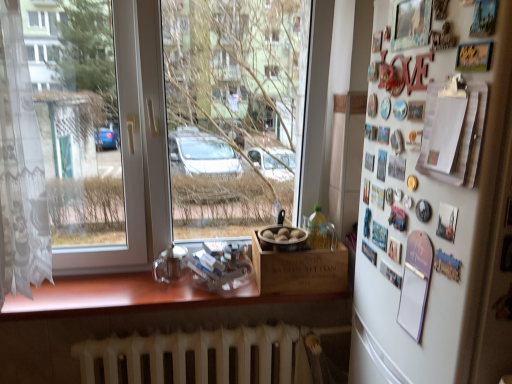
Question: Is white matte refrigerator at right bigger than wooden box at center?

Choices:
 (A) yes
 (B) no

Answer: (A)

Question: Is white matte refrigerator at right at the right side of wooden box at center?

Choices:
 (A) no
 (B) yes

Answer: (B)

Question: Is white matte refrigerator at right smaller than wooden box at center?

Choices:
 (A) yes
 (B) no

Answer: (B)

Question: From the image's perspective, is white matte refrigerator at right on wooden box at center?

Choices:
 (A) no
 (B) yes

Answer: (B)

Question: Is white matte refrigerator at right far from wooden box at center?

Choices:
 (A) yes
 (B) no

Answer: (B)

Question: From the image's perspective, is white matte refrigerator at right below wooden box at center?

Choices:
 (A) no
 (B) yes

Answer: (A)

Question: From the image's perspective, is white matte refrigerator at right located above wooden at lower center?

Choices:
 (A) no
 (B) yes

Answer: (B)

Question: Does white matte refrigerator at right appear on the left side of wooden at lower center?

Choices:
 (A) yes
 (B) no

Answer: (B)

Question: From a real-world perspective, is white matte refrigerator at right physically above wooden at lower center?

Choices:
 (A) yes
 (B) no

Answer: (A)

Question: Is white matte refrigerator at right at the right side of wooden at lower center?

Choices:
 (A) yes
 (B) no

Answer: (A)

Question: Is white matte refrigerator at right shorter than wooden at lower center?

Choices:
 (A) no
 (B) yes

Answer: (A)

Question: Can you confirm if white matte refrigerator at right is wider than wooden at lower center?

Choices:
 (A) no
 (B) yes

Answer: (B)

Question: Considering the relative positions of white metallic radiator at lower center and transparent glass window at center in the image provided, is white metallic radiator at lower center to the right of transparent glass window at center from the viewer's perspective?

Choices:
 (A) no
 (B) yes

Answer: (B)